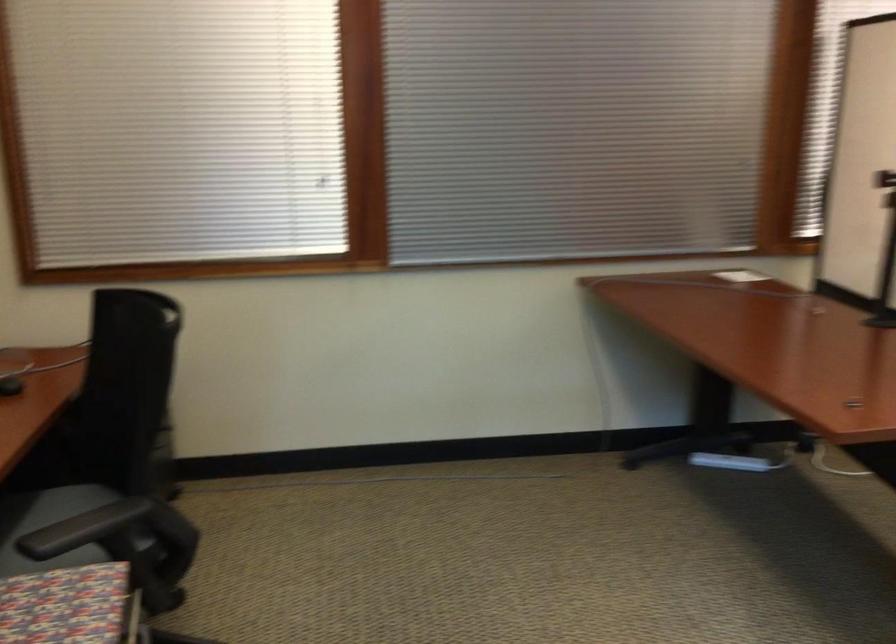
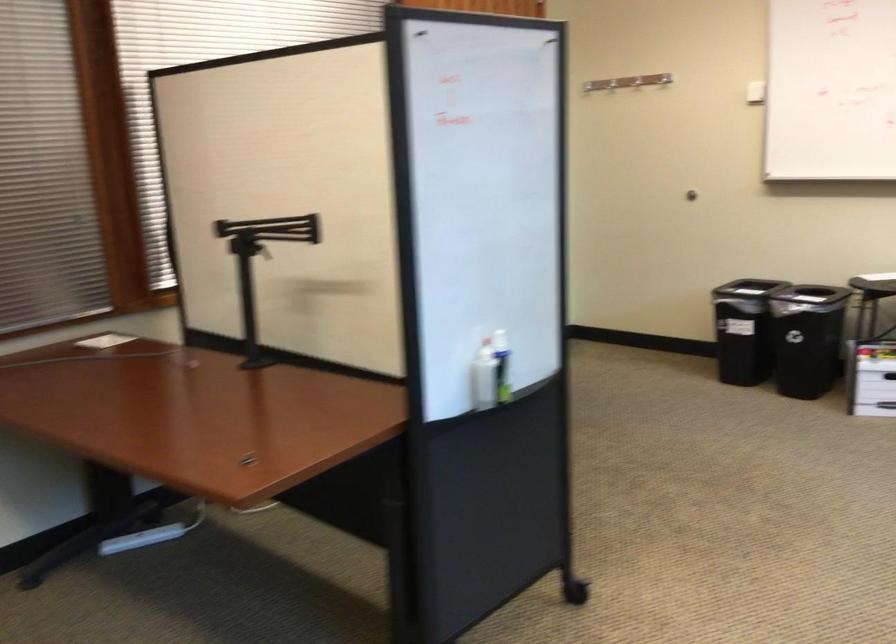
The point at (719, 464) is marked in the first image. Where is the corresponding point in the second image?

(141, 538)